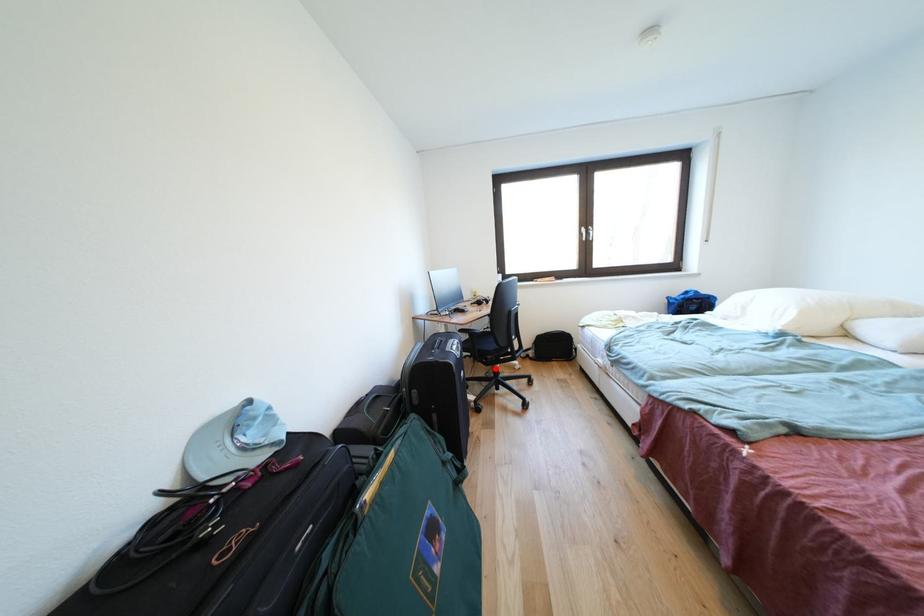
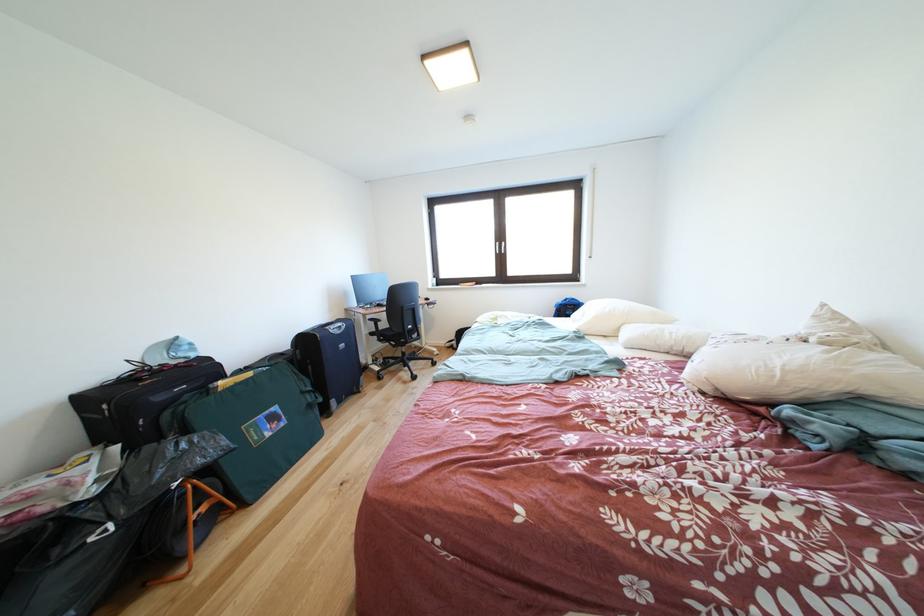
The point at the highlighted location is marked in the first image. Where is the corresponding point in the second image?

(403, 351)